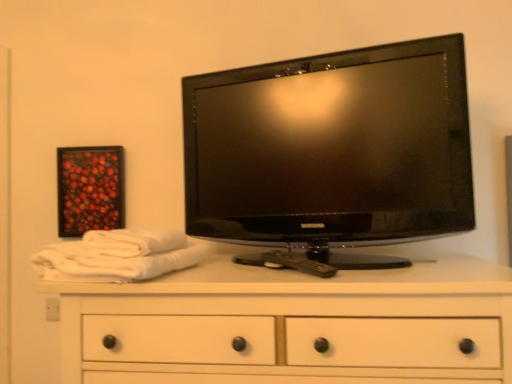
Question: From their relative heights in the image, would you say wooden framed artwork at upper left is taller or shorter than black glossy tv at upper center?

Choices:
 (A) tall
 (B) short

Answer: (B)

Question: Is wooden framed artwork at upper left to the left or to the right of black glossy tv at upper center in the image?

Choices:
 (A) right
 (B) left

Answer: (B)

Question: Considering the real-world distances, which object is farthest from the black glossy tv at upper center?

Choices:
 (A) white wood chest of drawers at center
 (B) wooden framed artwork at upper left
 (C) white cotton bath towel at left, the 1th bath towel positioned from the bottom
 (D) white cotton bath towel at left, which is the first bath towel from top to bottom

Answer: (B)

Question: Which is nearer to the white wood chest of drawers at center?

Choices:
 (A) wooden framed artwork at upper left
 (B) black glossy tv at upper center
 (C) white cotton bath towel at left, marked as the 2th bath towel in a top-to-bottom arrangement
 (D) white cotton bath towel at left, which is counted as the 2th bath towel, starting from the bottom

Answer: (C)